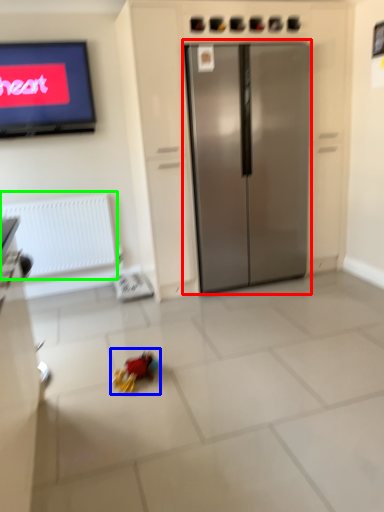
Question: Which object is positioned farthest from refrigerator (highlighted by a red box)? Select from miniature (highlighted by a blue box) and radiator (highlighted by a green box).

Choices:
 (A) miniature
 (B) radiator

Answer: (A)